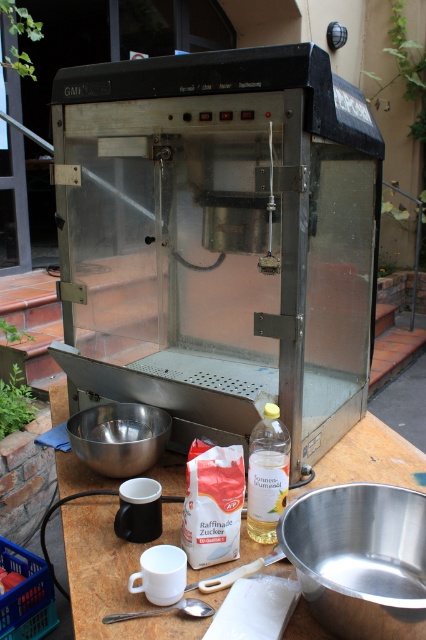
Describe the element at coordinates (109, 577) in the screenshot. I see `metallic table at center` at that location.

Does metallic table at center have a lesser width compared to polished silver mixing bowl at lower left?

In fact, metallic table at center might be wider than polished silver mixing bowl at lower left.

Does point (294, 636) lie in front of point (126, 424)?

Yes, point (294, 636) is closer to viewer.

Where is `metallic table at center`? metallic table at center is located at coordinates (109, 577).

Does white matte sugar packet at lower center have a lesser width compared to polished silver mixing bowl at lower left?

Indeed, white matte sugar packet at lower center has a lesser width compared to polished silver mixing bowl at lower left.

Is white matte sugar packet at lower center above polished silver mixing bowl at lower left?

No.

Which is in front, point (216, 500) or point (77, 448)?

Point (216, 500) is more forward.

You are a GUI agent. You are given a task and a screenshot of the screen. Output one action in this format:
    pyautogui.click(x=<x>, y=<y>)
    Task: Click on the white matte sugar packet at lower center
    
    Given the screenshot: What is the action you would take?
    tap(213, 502)

You are a GUI agent. You are given a task and a screenshot of the screen. Output one action in this format:
    pyautogui.click(x=<x>, y=<y>)
    Task: Click on the white matte sugar packet at lower center
    
    Given the screenshot: What is the action you would take?
    pyautogui.click(x=213, y=502)

Does white matte sugar packet at lower center come behind shiny metallic bowl at lower left?

No.

The height and width of the screenshot is (640, 426). I want to click on white matte sugar packet at lower center, so click(213, 502).

Image resolution: width=426 pixels, height=640 pixels. Find the location of `white matte sugar packet at lower center`. white matte sugar packet at lower center is located at coordinates [x=213, y=502].